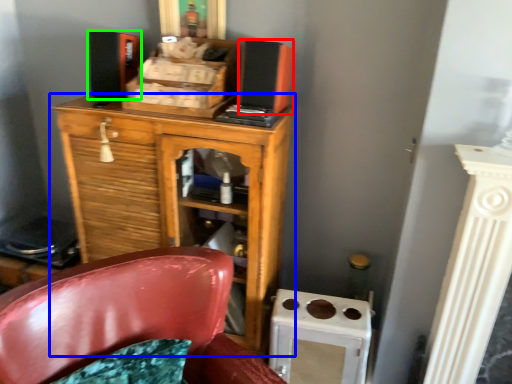
Question: Which object is the closest to the speaker (highlighted by a red box)? Choose among these: chest of drawers (highlighted by a blue box) or speaker (highlighted by a green box).

Choices:
 (A) chest of drawers
 (B) speaker

Answer: (A)